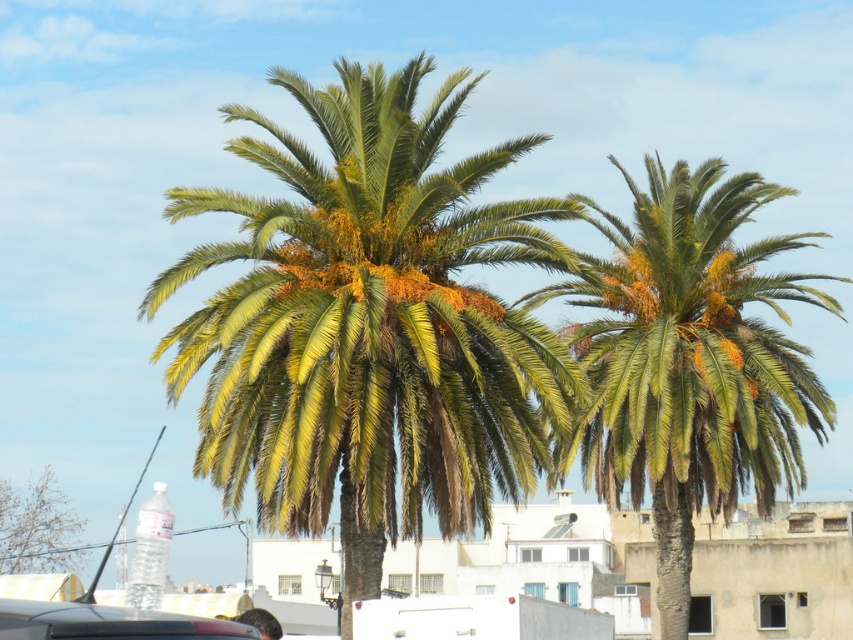
Is green leafy palm at center positioned before green leafy palm at lower left?

Yes.

Which is more to the left, green leafy palm at center or green leafy palm at lower left?

green leafy palm at lower left

Identify the location of green leafy palm at center. (369, 323).

At what (x,y) coordinates should I click in order to perform the action: click on green leafy palm at center. Please return your answer as a coordinate pair (x, y). Looking at the image, I should click on (369, 323).

In the scene shown: Who is positioned more to the left, green leafy palm at right or matte black car at lower left?

Positioned to the left is matte black car at lower left.

Can you confirm if green leafy palm at right is shorter than matte black car at lower left?

Incorrect, green leafy palm at right's height does not fall short of matte black car at lower left's.

Find the location of a particular element. This screenshot has width=853, height=640. green leafy palm at right is located at coordinates (689, 358).

Who is shorter, green leafy palm at center or matte black car at lower left?

matte black car at lower left is shorter.

Consider the image. Does green leafy palm at center have a lesser width compared to matte black car at lower left?

No, green leafy palm at center is not thinner than matte black car at lower left.

Is point (479, 513) closer to viewer compared to point (149, 636)?

No, (479, 513) is further to viewer.

At what (x,y) coordinates should I click in order to perform the action: click on green leafy palm at center. Please return your answer as a coordinate pair (x, y). Looking at the image, I should click on (369, 323).